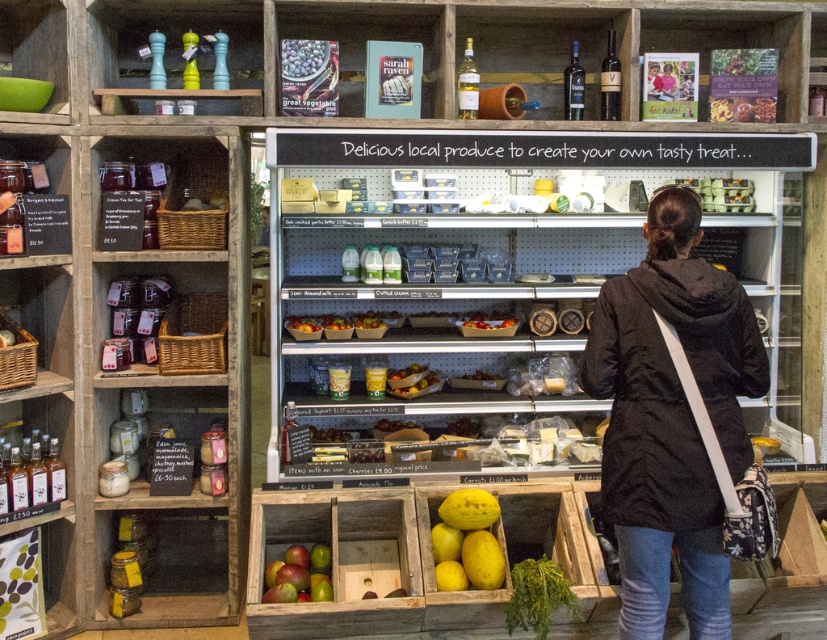
You are a customer in the store and want to pick up the green leafy vegetable at lower center. Can you reach it without moving the yellow matte melon at lower center?

The yellow matte melon at lower center is positioned over the green leafy vegetable at lower center, so you cannot reach the green leafy vegetable at lower center without moving the yellow matte melon at lower center.

You are a customer in the store and want to place the green leafy vegetable at lower center onto the clear plastic shelves at center. Based on their sizes, will the vegetable fit on the shelves?

The clear plastic shelves at center is larger in size than green leafy vegetable at lower center, so the vegetable will fit on the shelves.